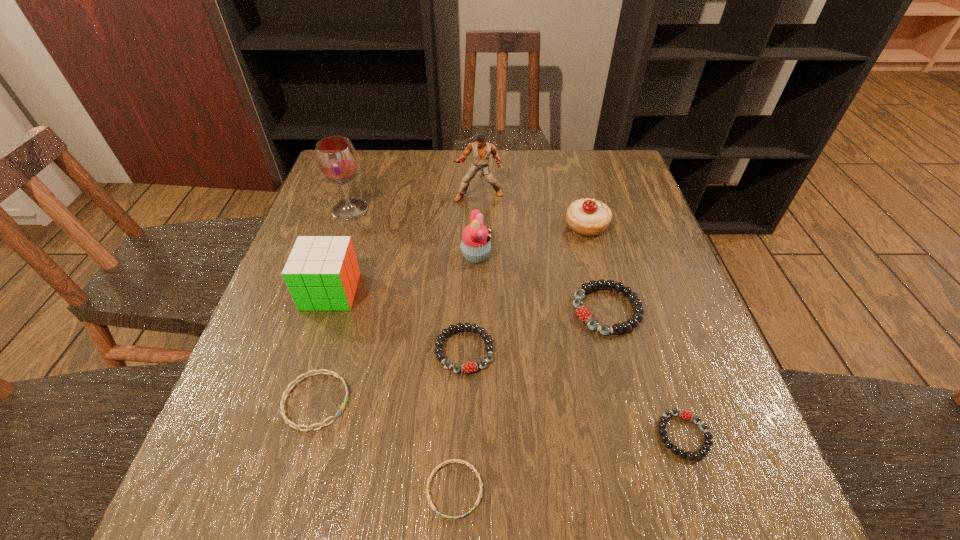
Where is `empty space between the cube and the right blue bracelet`? This screenshot has height=540, width=960. empty space between the cube and the right blue bracelet is located at coordinates (393, 390).

Find the location of a particular element. Image resolution: width=960 pixels, height=540 pixels. free space between the red wineglass and the seventh tallest object is located at coordinates (407, 280).

This screenshot has height=540, width=960. I want to click on the closest object to the fourth shortest object, so click(x=287, y=421).

I want to click on object identified as the ninth closest to the puncher, so click(453, 460).

Locate an element on the screen. The width and height of the screenshot is (960, 540). the closest bracelet to the nearer blue bracelet is located at coordinates (468, 367).

Identify which bracelet is located as the nearest to the smallest black bracelet. Please provide its 2D coordinates. Your answer should be formatted as a tuple, i.e. [(x, y)], where the tuple contains the x and y coordinates of a point satisfying the conditions above.

[(583, 313)]

This screenshot has width=960, height=540. In order to click on the second closest black bracelet to the beige pastry in this screenshot , I will do `click(468, 367)`.

Find the location of a particular element. This screenshot has height=540, width=960. the second closest black bracelet to the cube is located at coordinates (583, 313).

This screenshot has height=540, width=960. I want to click on blank area in the image that satisfies the following two spatial constraints: 1. on the front-facing side of the puncher; 2. on the surface of the bigger blue bracelet showing star-shaped elements, so click(x=478, y=401).

Find the location of a particular element. The width and height of the screenshot is (960, 540). vacant position in the image that satisfies the following two spatial constraints: 1. on the front-facing side of the puncher; 2. on the face of the fourth farthest object is located at coordinates (478, 256).